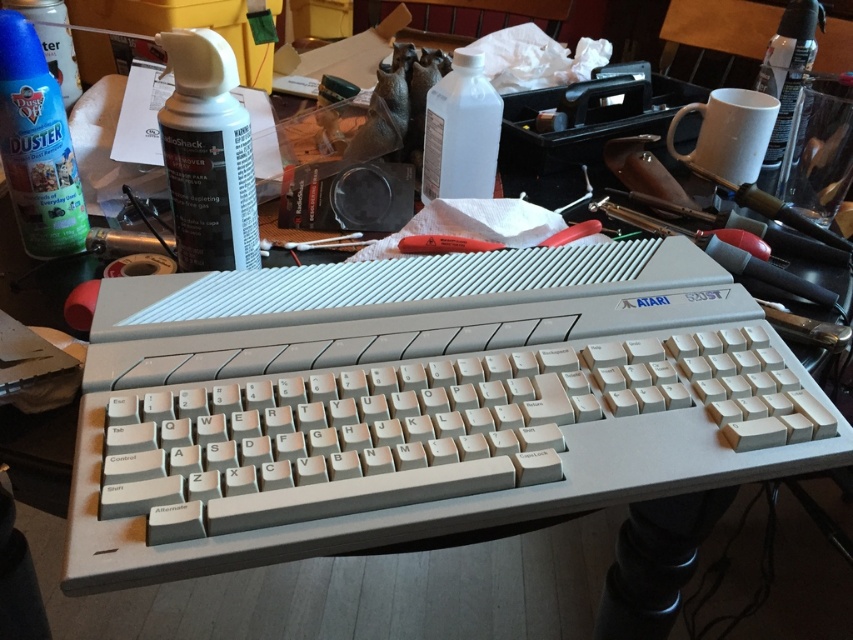
Does blue plastic duster at upper left have a greater width compared to transparent plastic bottle at upper center?

No.

Is point (65, 172) behind point (444, 154)?

No, (65, 172) is in front of (444, 154).

Find the location of a particular element. blue plastic duster at upper left is located at coordinates (38, 145).

Between white matte spray can at upper left and red plastic screwdriver at center, which one is positioned higher?

white matte spray can at upper left is higher up.

Does point (180, 262) come in front of point (558, 234)?

Yes, it is.

Find the location of `white matte spray can at upper left`. white matte spray can at upper left is located at coordinates (207, 154).

Can you confirm if white matte spray can at upper left is shorter than blue plastic spray can at upper left?

No, white matte spray can at upper left is not shorter than blue plastic spray can at upper left.

Is white matte spray can at upper left taller than blue plastic spray can at upper left?

Correct, white matte spray can at upper left is much taller as blue plastic spray can at upper left.

Is point (215, 90) positioned before point (67, 33)?

Yes, point (215, 90) is in front of point (67, 33).

Image resolution: width=853 pixels, height=640 pixels. What are the coordinates of `white matte spray can at upper left` in the screenshot? It's located at (207, 154).